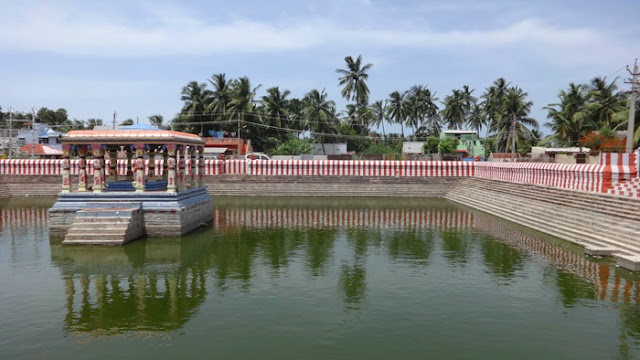
Find the location of a particular element. Image resolution: width=640 pixels, height=360 pixels. pillar is located at coordinates (138, 177).